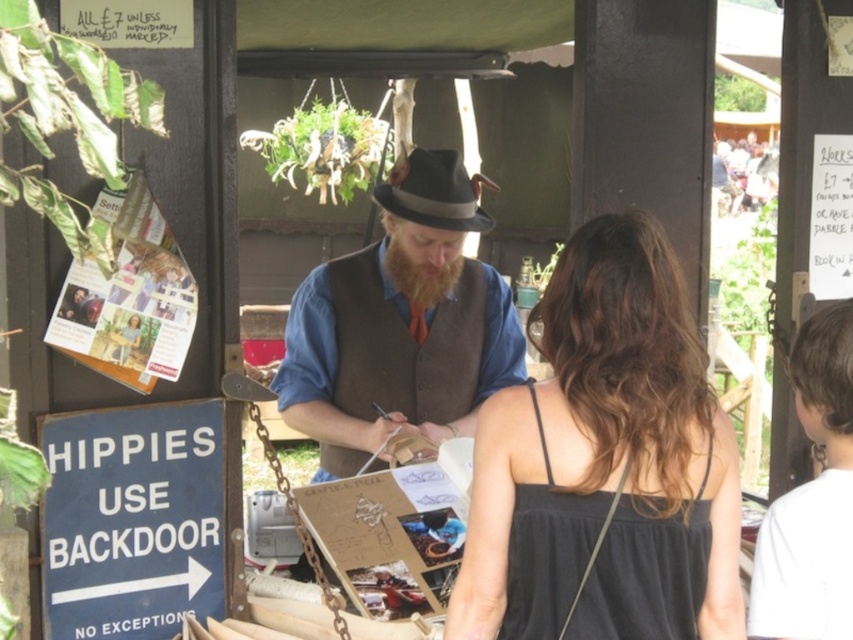
You are a customer at the market and want to approach the vendor. You see the brown woolen vest at center and the dark brown fuzzy beard at center. Which object is closer to the ground?

The brown woolen vest at center is located below dark brown fuzzy beard at center, so the brown woolen vest at center is closer to the ground.

You are a customer at the market and want to identify the vendor based on their clothing. Which object from the scene has a greater height between the brown woolen vest at center and the dark brown fuzzy beard at center?

The brown woolen vest at center has a greater height compared to the dark brown fuzzy beard at center.

You are a photographer at the market and want to capture both the black fabric dress at center and the gray felt fedora at center in a single frame. Based on their sizes, which object should you focus on to ensure both fit in the shot?

The black fabric dress at center might be wider than the gray felt fedora at center, so focusing on the dress would help ensure both fit in the frame since it is likely larger.